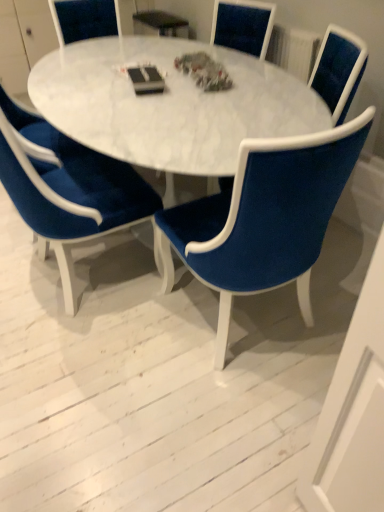
Question: Is velvet blue chair at center, the first chair in the left-to-right sequence, beside white marble table at center?

Choices:
 (A) no
 (B) yes

Answer: (A)

Question: From a real-world perspective, is velvet blue chair at center, the 3th chair when ordered from right to left, under white marble table at center?

Choices:
 (A) yes
 (B) no

Answer: (A)

Question: Is velvet blue chair at center, the 3th chair when ordered from right to left, further to camera compared to white marble table at center?

Choices:
 (A) no
 (B) yes

Answer: (A)

Question: From the image's perspective, is velvet blue chair at center, the 3th chair when ordered from right to left, on top of white marble table at center?

Choices:
 (A) yes
 (B) no

Answer: (B)

Question: Is velvet blue chair at center, the 3th chair when ordered from right to left, aimed at white marble table at center?

Choices:
 (A) yes
 (B) no

Answer: (B)

Question: Is white marble table at center in front of or behind velvet blue chair at center, the 1th chair positioned from the right, in the image?

Choices:
 (A) behind
 (B) front

Answer: (A)

Question: Considering the positions of white marble table at center and velvet blue chair at center, which is the third chair from left to right, in the image, is white marble table at center wider or thinner than velvet blue chair at center, which is the third chair from left to right,?

Choices:
 (A) wide
 (B) thin

Answer: (A)

Question: From a real-world perspective, is white marble table at center physically located above or below velvet blue chair at center, which is the third chair from left to right?

Choices:
 (A) below
 (B) above

Answer: (B)

Question: From the image's perspective, is white marble table at center above or below velvet blue chair at center, the 1th chair positioned from the right?

Choices:
 (A) above
 (B) below

Answer: (A)

Question: Relative to velvet blue chair at center, the 1th chair positioned from the right, is velvet blue chair at center, the first chair in the left-to-right sequence, in front or behind?

Choices:
 (A) behind
 (B) front

Answer: (B)

Question: From a real-world perspective, is velvet blue chair at center, the 3th chair when ordered from right to left, physically located above or below velvet blue chair at center, which is the third chair from left to right?

Choices:
 (A) above
 (B) below

Answer: (B)

Question: Is velvet blue chair at center, the 3th chair when ordered from right to left, wider or thinner than velvet blue chair at center, which is the third chair from left to right?

Choices:
 (A) wide
 (B) thin

Answer: (A)

Question: Does point (62, 167) appear closer or farther from the camera than point (345, 53)?

Choices:
 (A) closer
 (B) farther

Answer: (B)

Question: Would you say velvet blue chair at center, the 1th chair positioned from the right, is inside or outside velvet blue chair at center, the first chair in the left-to-right sequence?

Choices:
 (A) outside
 (B) inside

Answer: (A)

Question: From a real-world perspective, is velvet blue chair at center, the 1th chair positioned from the right, physically located above or below velvet blue chair at center, the first chair in the left-to-right sequence?

Choices:
 (A) below
 (B) above

Answer: (B)